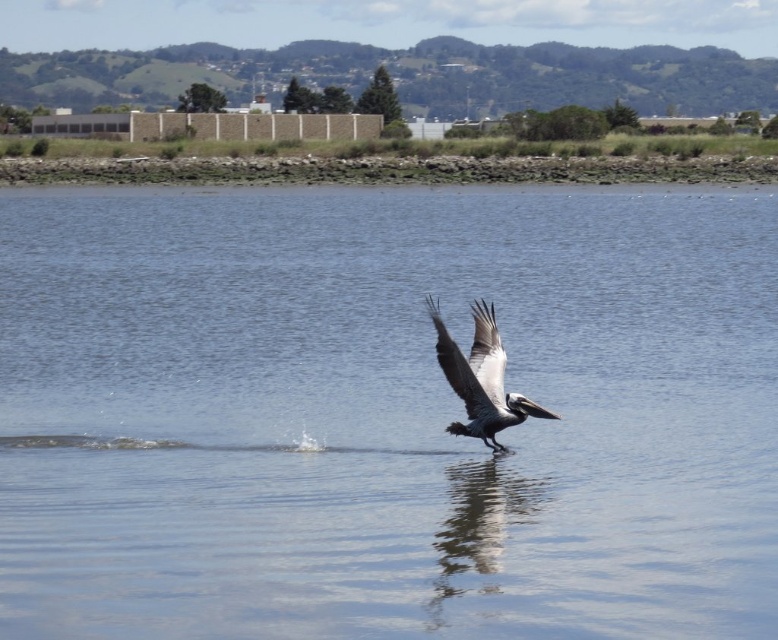
Is clear water at center positioned behind gray feathered wing at center?

No, it is not.

Can you confirm if clear water at center is thinner than gray feathered wing at center?

Incorrect, clear water at center's width is not less than gray feathered wing at center's.

Which is behind, point (365, 236) or point (482, 310)?

Positioned behind is point (365, 236).

I want to click on clear water at center, so click(x=384, y=413).

Does gray feathered wing at center have a larger size compared to white feathered wing at center?

No.

Is point (475, 342) farther from viewer compared to point (437, 346)?

Yes, point (475, 342) is behind point (437, 346).

Which is behind, point (505, 360) or point (484, 406)?

Positioned behind is point (505, 360).

The height and width of the screenshot is (640, 778). I want to click on gray feathered wing at center, so click(486, 353).

Is point (449, 384) positioned in front of point (444, 374)?

That is True.

Locate an element on the screen. This screenshot has height=640, width=778. brown feathered pelican at center is located at coordinates (482, 378).